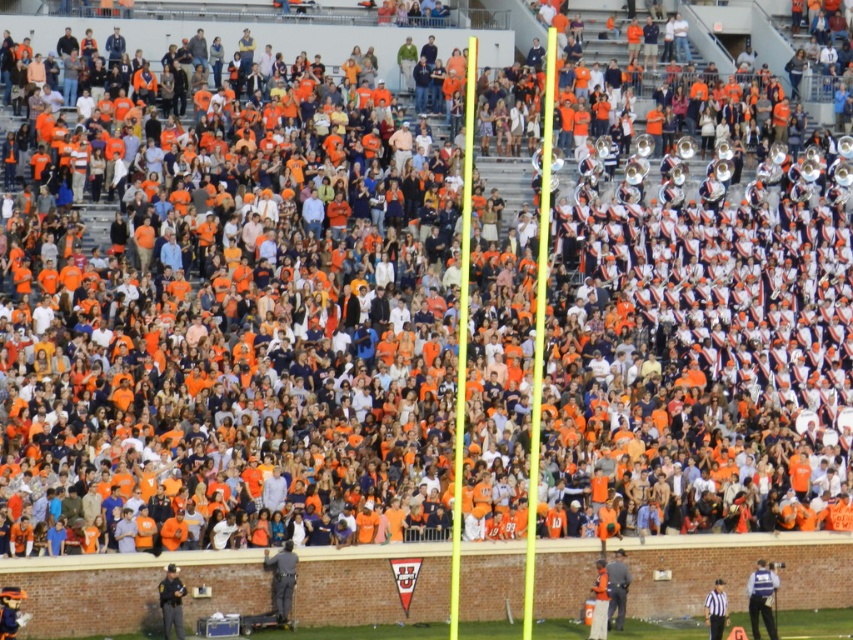
Question: Which point is closer to the camera taking this photo?

Choices:
 (A) (711, 634)
 (B) (618, 621)

Answer: (A)

Question: Which object is positioned closest to the striped fabric referee at lower right?

Choices:
 (A) blue uniform at center
 (B) gray fabric jacket at lower right

Answer: (B)

Question: From the image, what is the correct spatial relationship of gray fabric jacket at lower right in relation to striped fabric referee at lower right?

Choices:
 (A) below
 (B) above

Answer: (B)

Question: Can you confirm if gray fabric jacket at lower right is positioned above striped fabric referee at lower right?

Choices:
 (A) no
 (B) yes

Answer: (B)

Question: Can you confirm if blue uniform at center is positioned to the left of striped fabric referee at lower right?

Choices:
 (A) no
 (B) yes

Answer: (A)

Question: Among these points, which one is nearest to the camera?

Choices:
 (A) coord(610,589)
 (B) coord(717,586)
 (C) coord(759,572)

Answer: (A)